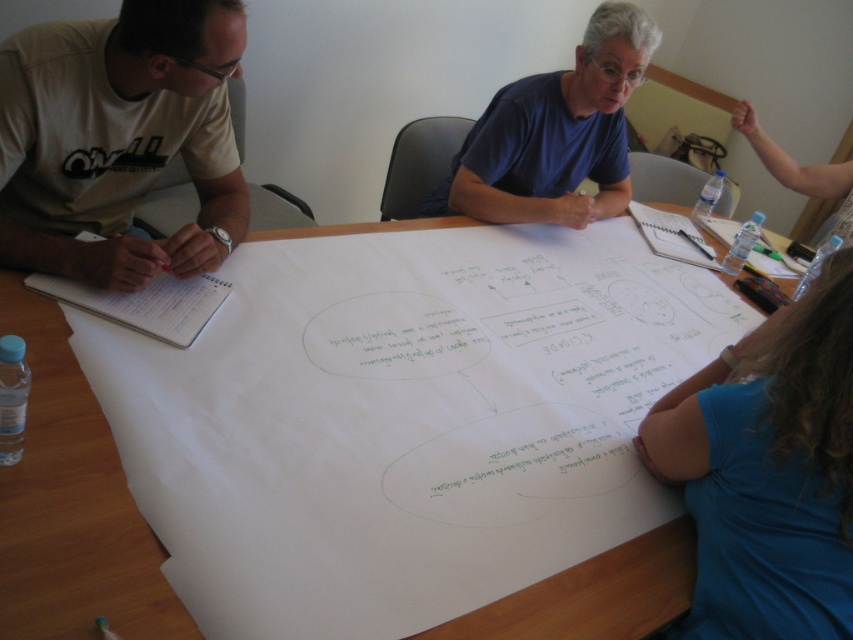
You are observing a brainstorming session at the table. There is a blue fabric shirt at lower right and a white paper at left. Which object is closer to the bottom edge of the image?

The blue fabric shirt at lower right is positioned under the white paper at left, meaning it is closer to the bottom edge of the image.

You are part of the brainstorming team and need to reference both the white paper at center and the white paper at left. Which one is closer to you if you are sitting at the left side of the table?

The white paper at center is closer to you because it is in front of the white paper at left.

You are a participant in the brainstorming session and need to refer to the white paper at center and the white paper at left. Which paper is positioned lower on the table?

The white paper at center is located below the white paper at left, so the white paper at center is positioned lower on the table.